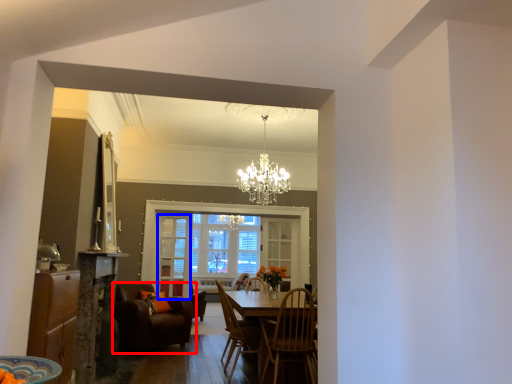
Question: Among these objects, which one is nearest to the camera, chair (highlighted by a red box) or glass door (highlighted by a blue box)?

Choices:
 (A) chair
 (B) glass door

Answer: (A)